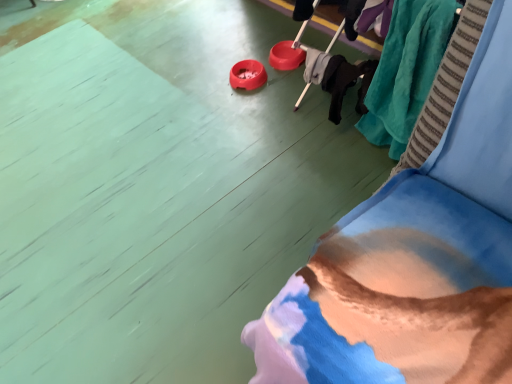
Question: In terms of height, does velvet blue couch at lower right look taller or shorter compared to teal plush blanket at upper right?

Choices:
 (A) tall
 (B) short

Answer: (B)

Question: Is velvet blue couch at lower right spatially inside teal plush blanket at upper right, or outside of it?

Choices:
 (A) outside
 (B) inside

Answer: (A)

Question: From a real-world perspective, relative to teal plush blanket at upper right, is velvet blue couch at lower right vertically above or below?

Choices:
 (A) above
 (B) below

Answer: (B)

Question: Do you think teal plush blanket at upper right is within velvet blue couch at lower right, or outside of it?

Choices:
 (A) inside
 (B) outside

Answer: (B)

Question: Is teal plush blanket at upper right bigger or smaller than velvet blue couch at lower right?

Choices:
 (A) big
 (B) small

Answer: (B)

Question: Looking at their shapes, would you say teal plush blanket at upper right is wider or thinner than velvet blue couch at lower right?

Choices:
 (A) wide
 (B) thin

Answer: (B)

Question: Considering their positions, is teal plush blanket at upper right located in front of or behind velvet blue couch at lower right?

Choices:
 (A) front
 (B) behind

Answer: (B)